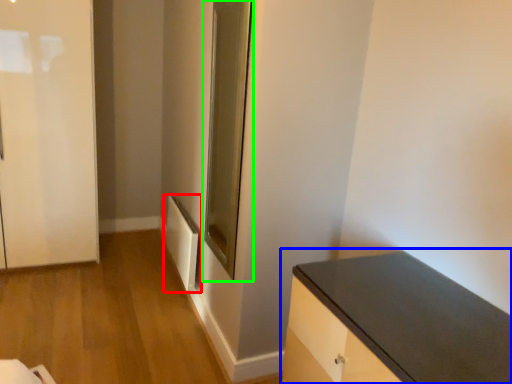
Question: Which object is the farthest from radiator (highlighted by a red box)? Choose among these: countertop (highlighted by a blue box) or glass door (highlighted by a green box).

Choices:
 (A) countertop
 (B) glass door

Answer: (A)